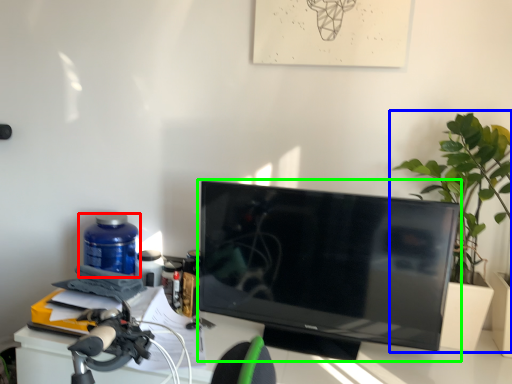
Question: Based on their relative distances, which object is farther from bottle (highlighted by a red box)? Choose from houseplant (highlighted by a blue box) and television (highlighted by a green box).

Choices:
 (A) houseplant
 (B) television

Answer: (A)